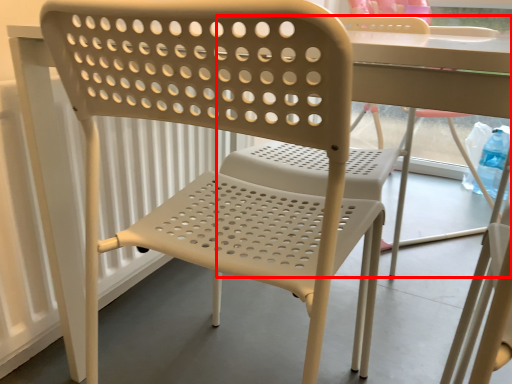
Question: Observing the image, what is the correct spatial positioning of chair (annotated by the red box) in reference to chair?

Choices:
 (A) left
 (B) right

Answer: (B)